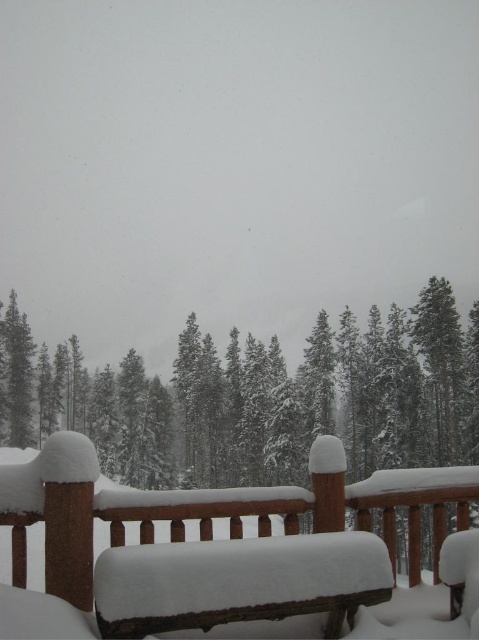
Question: Is snow-covered wood bench at center closer to camera compared to snow-covered pine at center?

Choices:
 (A) no
 (B) yes

Answer: (B)

Question: Is snow-covered wood bench at center positioned before snow-covered pine at center?

Choices:
 (A) no
 (B) yes

Answer: (B)

Question: Which point is farther from the camera taking this photo?

Choices:
 (A) (371, 467)
 (B) (205, 493)

Answer: (A)

Question: Which point is farther to the camera?

Choices:
 (A) (469, 420)
 (B) (114, 497)

Answer: (A)

Question: Can you confirm if snow-covered wood bench at center is positioned to the right of snow-covered pine at center?

Choices:
 (A) yes
 (B) no

Answer: (B)